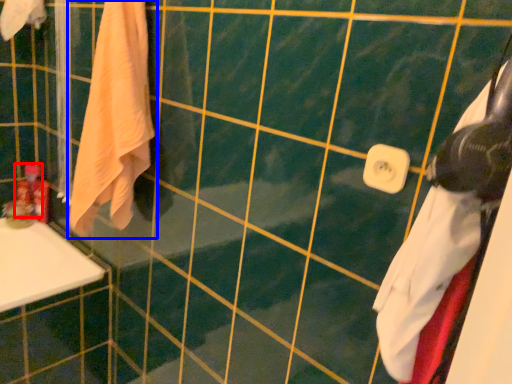
Question: Which of the following is the closest to the observer, toiletry (highlighted by a red box) or towel (highlighted by a blue box)?

Choices:
 (A) toiletry
 (B) towel

Answer: (B)